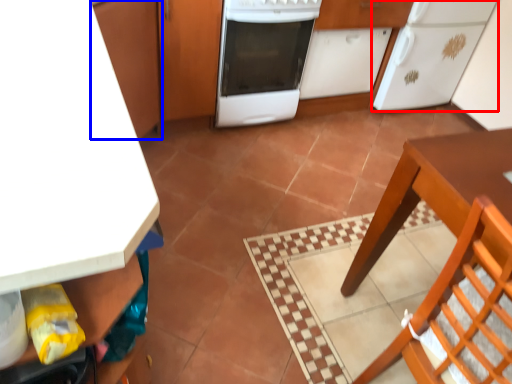
Question: Which point is further to the camera, kitchen appliance (highlighted by a red box) or cabinetry (highlighted by a blue box)?

Choices:
 (A) kitchen appliance
 (B) cabinetry

Answer: (A)